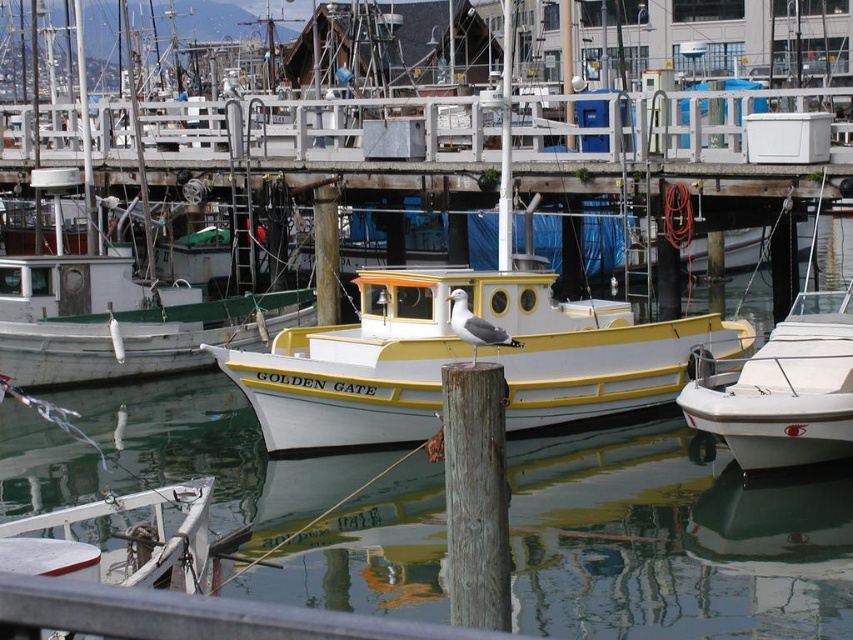
Between clear water at center and white matte boat at right, which one is positioned lower?

clear water at center

Locate an element on the screen. Image resolution: width=853 pixels, height=640 pixels. clear water at center is located at coordinates (674, 538).

Find the location of a particular element. clear water at center is located at coordinates (674, 538).

Between white/yellow fiberglass boat at center and gray wood post at center, which one is positioned higher?

white/yellow fiberglass boat at center

The height and width of the screenshot is (640, 853). What do you see at coordinates (463, 358) in the screenshot? I see `white/yellow fiberglass boat at center` at bounding box center [463, 358].

Where is `white/yellow fiberglass boat at center`? white/yellow fiberglass boat at center is located at coordinates (463, 358).

Which of these two, white matte boat at center or white matte boat at right, stands taller?

white matte boat at center

Is white matte boat at center shorter than white matte boat at right?

No, white matte boat at center is not shorter than white matte boat at right.

I want to click on white matte boat at center, so click(103, 276).

Where is `white matte boat at center`? This screenshot has height=640, width=853. white matte boat at center is located at coordinates (103, 276).